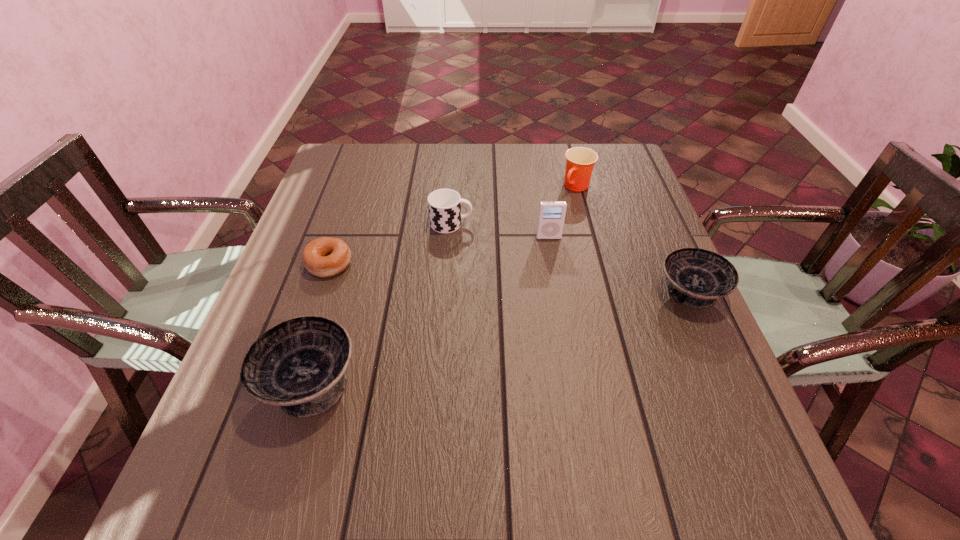
If equal spacing is the goal by inserting an additional bowl among them, please point out a vacant space for this new bowl. Please provide its 2D coordinates. Your answer should be formatted as a tuple, i.e. [(x, y)], where the tuple contains the x and y coordinates of a point satisfying the conditions above.

[(516, 334)]